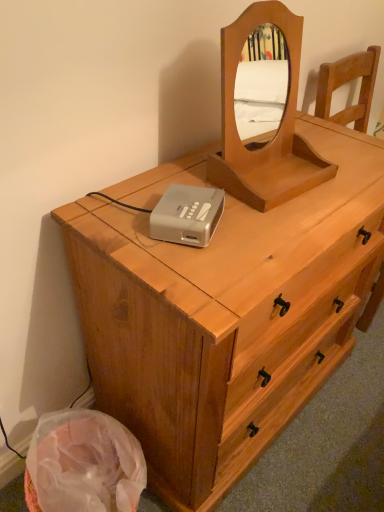
Question: In terms of width, does light brown wood chest of drawers at center look wider or thinner when compared to light brown wooden mirror at upper center?

Choices:
 (A) thin
 (B) wide

Answer: (B)

Question: Visually, is light brown wood chest of drawers at center positioned to the left or to the right of light brown wooden mirror at upper center?

Choices:
 (A) right
 (B) left

Answer: (B)

Question: Estimate the real-world distances between objects in this image. Which object is closer to the light brown wood chest of drawers at center?

Choices:
 (A) silver plastic cassette at center
 (B) light brown wooden mirror at upper center

Answer: (B)

Question: Estimate the real-world distances between objects in this image. Which object is closer to the light brown wood chest of drawers at center?

Choices:
 (A) light brown wooden mirror at upper center
 (B) silver plastic cassette at center

Answer: (A)